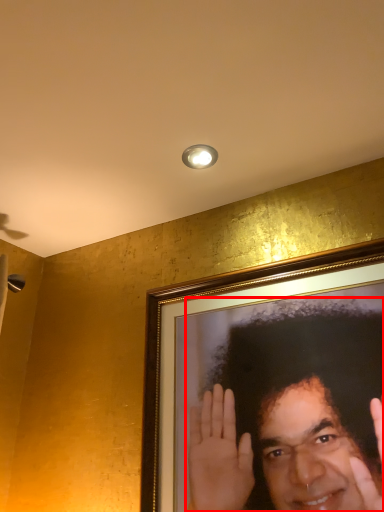
Question: Considering the relative positions of man (annotated by the red box) and light fixture in the image provided, where is man (annotated by the red box) located with respect to the staircase?

Choices:
 (A) right
 (B) left

Answer: (A)